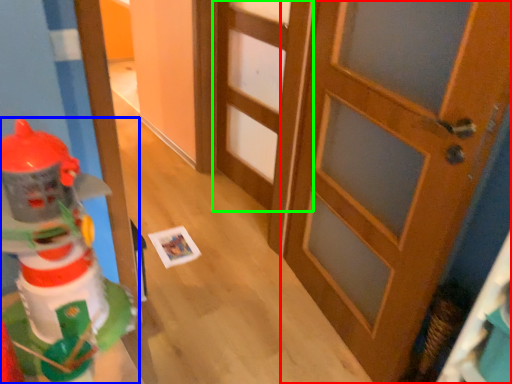
Question: Estimate the real-world distances between objects in this image. Which object is farther from door (highlighted by a red box), toy (highlighted by a blue box) or door (highlighted by a green box)?

Choices:
 (A) toy
 (B) door

Answer: (A)